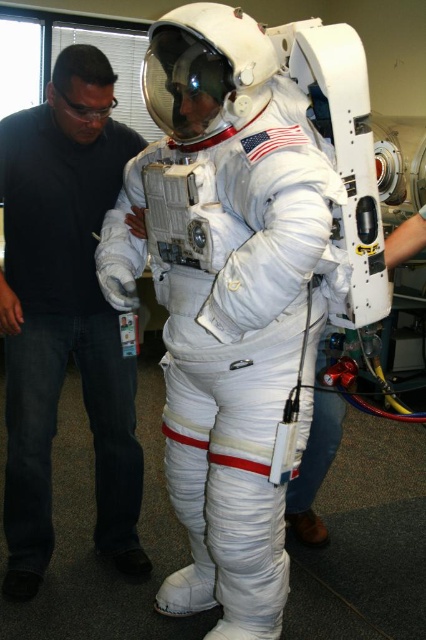
Can you confirm if white fabric astronaut at center is wider than white matte astronaut suit at center?

Yes, white fabric astronaut at center is wider than white matte astronaut suit at center.

Between point (115, 234) and point (36, 230), which one is positioned in front?

Point (115, 234) is more forward.

Image resolution: width=426 pixels, height=640 pixels. Identify the location of white fabric astronaut at center. (230, 300).

Does point (123, 554) come farther from viewer compared to point (104, 97)?

That is True.

Locate an element on the screen. white matte astronaut suit at center is located at coordinates (63, 333).

Does point (173, 305) come closer to viewer compared to point (81, 93)?

Yes, it is.

Is white fabric astronaut at center smaller than clear plastic goggles at upper left?

No, white fabric astronaut at center is not smaller than clear plastic goggles at upper left.

Identify the location of white fabric astronaut at center. (230, 300).